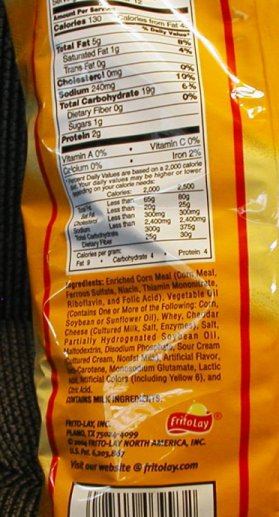
Where is `fabric`? fabric is located at coordinates (12, 141).